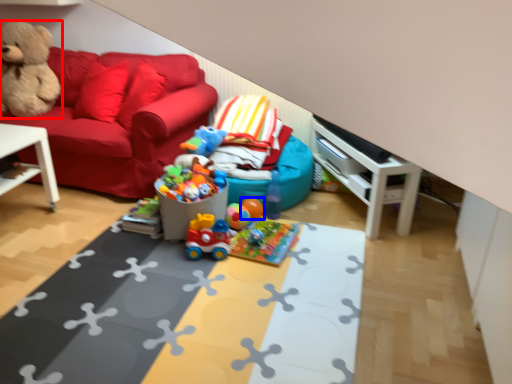
Question: Which object appears closest to the camera in this image, teddy bear (highlighted by a red box) or toy (highlighted by a blue box)?

Choices:
 (A) teddy bear
 (B) toy

Answer: (B)